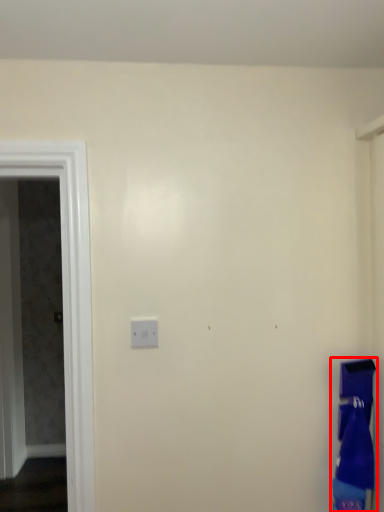
Question: From the image, what is the correct spatial relationship of laundry (annotated by the red box) in relation to screen door?

Choices:
 (A) right
 (B) left

Answer: (A)